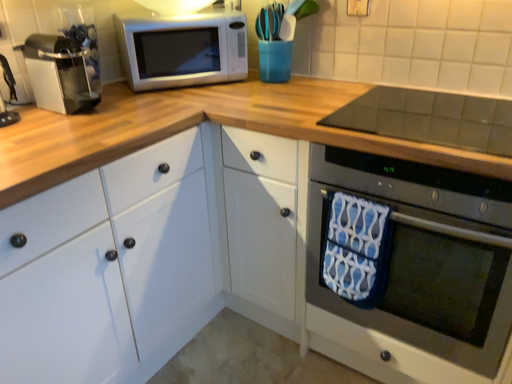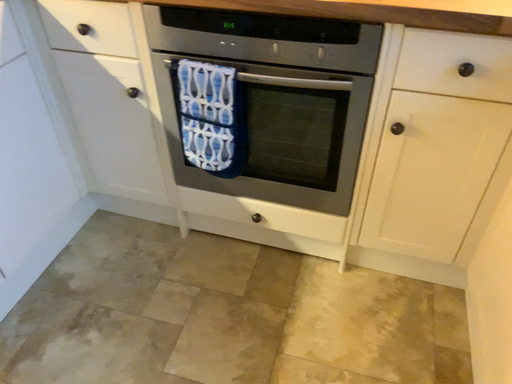
Question: Which way did the camera rotate in the video?

Choices:
 (A) rotated left
 (B) rotated right

Answer: (B)